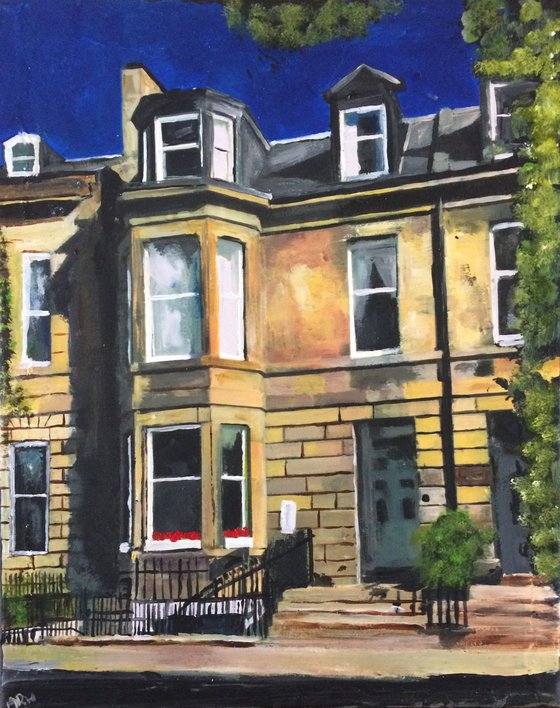
Where is `second story bay window, top left of center`? This screenshot has height=708, width=560. second story bay window, top left of center is located at coordinates (212, 302).